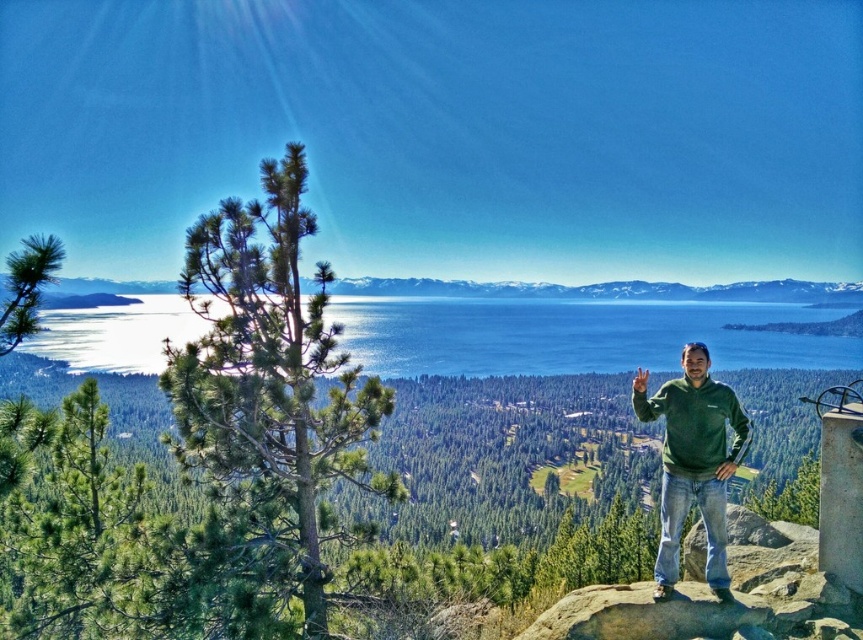
You are an outdoor enthusiast planning to hike to the snowy mountain at center. You notice the green fleece at right from your current position. Which object would you need to navigate around first based on their sizes?

The green fleece at right is much taller than the snowy mountain at center, so you would need to navigate around the green fleece at right first since it is larger and closer in your line of sight.

You are a hiker planning to cross the blue water at center and the green fleece at right. Based on the scene, which path would allow you to cross without getting wet?

The green fleece at right is a path that won not get you wet since it is on the right side of the blue water at center.